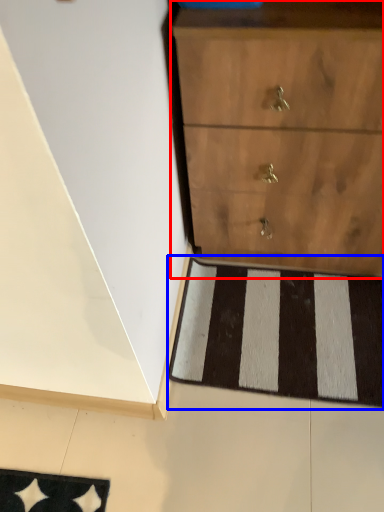
Question: Which of the following is the farthest to the observer, chest of drawers (highlighted by a red box) or doormat (highlighted by a blue box)?

Choices:
 (A) chest of drawers
 (B) doormat

Answer: (B)